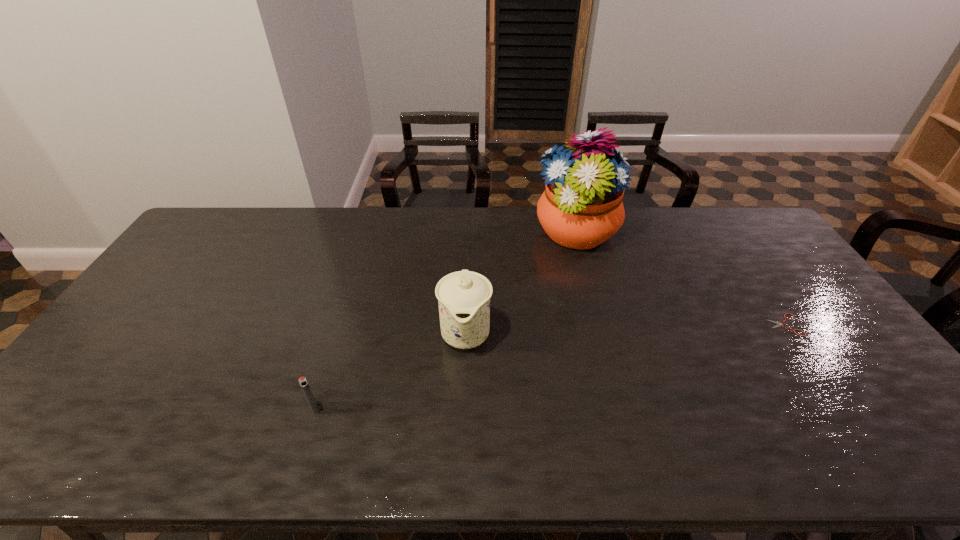
This screenshot has height=540, width=960. In order to click on vacant space that satisfies the following two spatial constraints: 1. on the back side of the third tallest object; 2. on the left side of the rightmost object in this screenshot , I will do `click(341, 325)`.